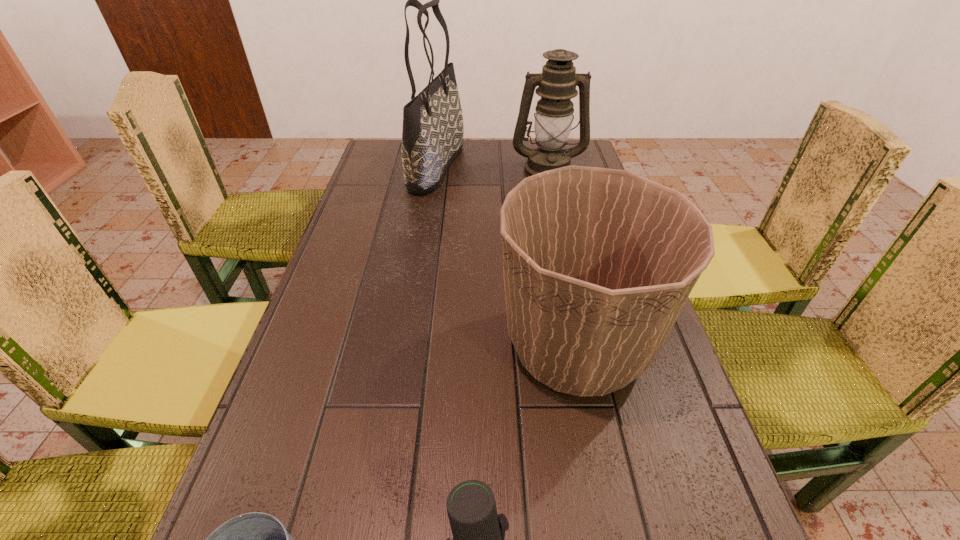
Locate an element on the screen. This screenshot has width=960, height=540. the fourth closest object relative to the shortest object is located at coordinates (557, 83).

Locate an element on the screen. the second closest object to the oil lamp is located at coordinates (598, 263).